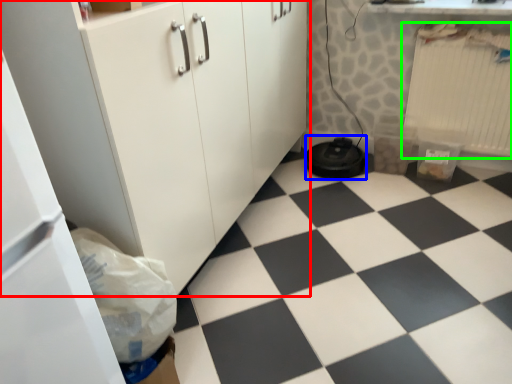
Question: Which is nearer to the cabinetry (highlighted by a red box)? water heater (highlighted by a blue box) or radiator (highlighted by a green box).

Choices:
 (A) water heater
 (B) radiator

Answer: (A)